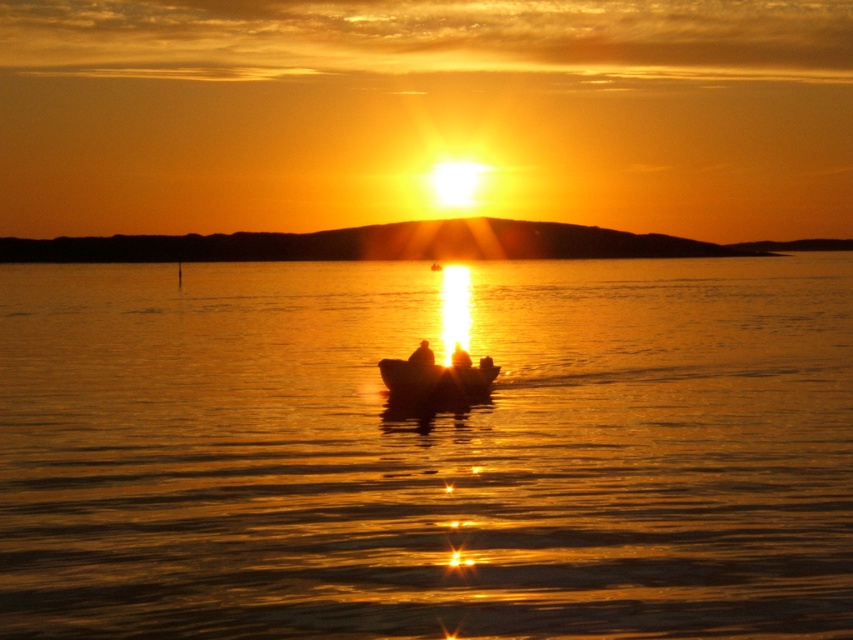
Which is above, glistening golden water at center or silhouette human at center?

Positioned higher is glistening golden water at center.

Which is more to the left, glistening golden water at center or silhouette human at center?

From the viewer's perspective, silhouette human at center appears more on the left side.

Which is behind, point (241, 480) or point (451, 358)?

The point (451, 358) is more distant.

Locate an element on the screen. The image size is (853, 640). glistening golden water at center is located at coordinates (427, 449).

Is the position of glistening golden water at center more distant than that of smooth wooden boat at center?

No, glistening golden water at center is closer to the viewer.

Is glistening golden water at center smaller than smooth wooden boat at center?

No.

Who is more distant from viewer, (491, 634) or (456, 392)?

The point (456, 392) is more distant.

Find the location of a particular element. Image resolution: width=853 pixels, height=640 pixels. glistening golden water at center is located at coordinates (427, 449).

Between smooth wooden boat at center and silhouette human at center, which one is positioned higher?

silhouette human at center is higher up.

Does point (495, 371) lie in front of point (459, 353)?

No, (495, 371) is further to viewer.

At what (x,y) coordinates should I click in order to perform the action: click on smooth wooden boat at center. Please return your answer as a coordinate pair (x, y). Image resolution: width=853 pixels, height=640 pixels. Looking at the image, I should click on (434, 381).